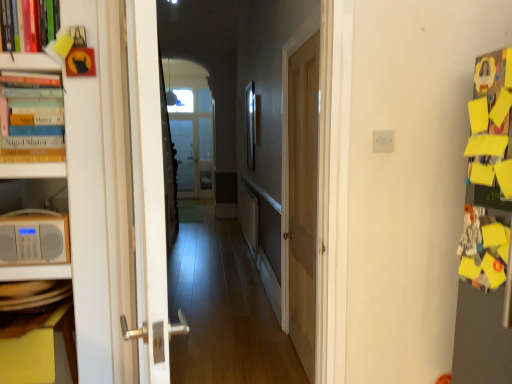
Question: From a real-world perspective, is matte white radio at left under hardcover books at left?

Choices:
 (A) no
 (B) yes

Answer: (B)

Question: Is matte white radio at left at the left side of hardcover books at left?

Choices:
 (A) no
 (B) yes

Answer: (A)

Question: Considering the relative positions of matte white radio at left and hardcover books at left in the image provided, is matte white radio at left to the right of hardcover books at left from the viewer's perspective?

Choices:
 (A) no
 (B) yes

Answer: (B)

Question: Can you confirm if matte white radio at left is thinner than hardcover books at left?

Choices:
 (A) yes
 (B) no

Answer: (A)

Question: Is the surface of matte white radio at left in direct contact with hardcover books at left?

Choices:
 (A) no
 (B) yes

Answer: (A)

Question: Can we say matte white radio at left lies outside hardcover books at left?

Choices:
 (A) yes
 (B) no

Answer: (A)

Question: Does wooden door at center, marked as the 2th door in a front-to-back arrangement, have a larger size compared to matte white radio at left?

Choices:
 (A) yes
 (B) no

Answer: (A)

Question: From a real-world perspective, is wooden door at center, the second door positioned from the left, on matte white radio at left?

Choices:
 (A) no
 (B) yes

Answer: (A)

Question: Could you tell me if wooden door at center, positioned as the first door in right-to-left order, is facing matte white radio at left?

Choices:
 (A) yes
 (B) no

Answer: (B)

Question: Does wooden door at center, positioned as the first door in right-to-left order, have a lesser height compared to matte white radio at left?

Choices:
 (A) no
 (B) yes

Answer: (A)

Question: Is wooden door at center, positioned as the first door in right-to-left order, thinner than matte white radio at left?

Choices:
 (A) yes
 (B) no

Answer: (B)

Question: Does wooden door at center, positioned as the first door in right-to-left order, lie in front of matte white radio at left?

Choices:
 (A) yes
 (B) no

Answer: (B)

Question: Considering the relative sizes of white plastic electric outlet at center and hardcover books at left in the image provided, is white plastic electric outlet at center taller than hardcover books at left?

Choices:
 (A) yes
 (B) no

Answer: (B)